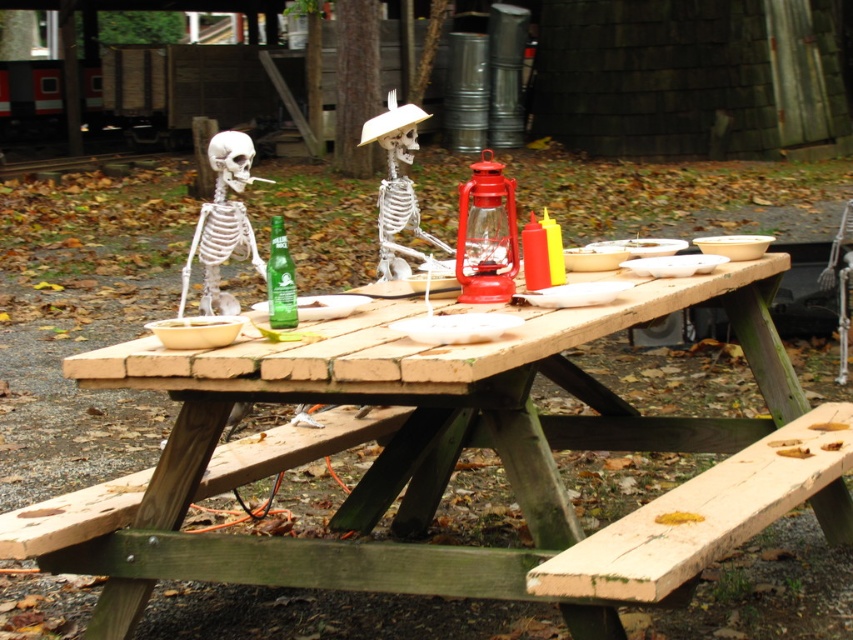
Question: Is wooden picnic table at center smaller than white bone skeleton at left?

Choices:
 (A) yes
 (B) no

Answer: (B)

Question: Among these points, which one is farthest from the camera?

Choices:
 (A) (221, 180)
 (B) (387, 243)
 (C) (283, 228)
 (D) (173, 376)

Answer: (B)

Question: Does wooden picnic table at center appear over green glass bottle at center?

Choices:
 (A) no
 (B) yes

Answer: (A)

Question: Which point is farther from the camera taking this photo?

Choices:
 (A) (340, 588)
 (B) (413, 253)

Answer: (B)

Question: Is the position of wooden picnic table at center less distant than that of green glass bottle at center?

Choices:
 (A) no
 (B) yes

Answer: (B)

Question: Which object is positioned farthest from the white bone skeleton at left?

Choices:
 (A) white matte skeleton at center
 (B) wooden picnic table at center
 (C) green glass bottle at center

Answer: (B)